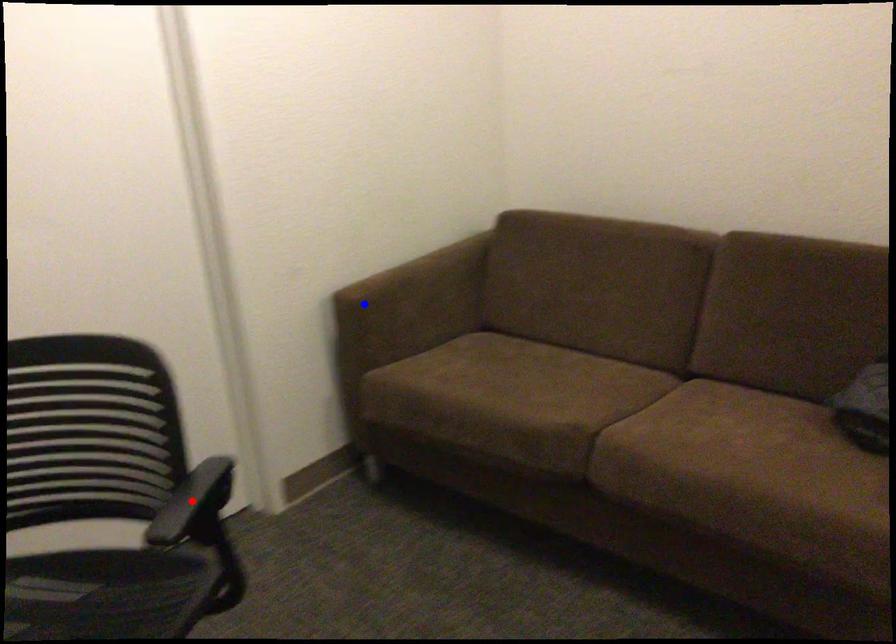
Question: In the image, two points are highlighted. Which point is nearer to the camera? Reply with the corresponding letter.

Choices:
 (A) blue point
 (B) red point

Answer: (B)